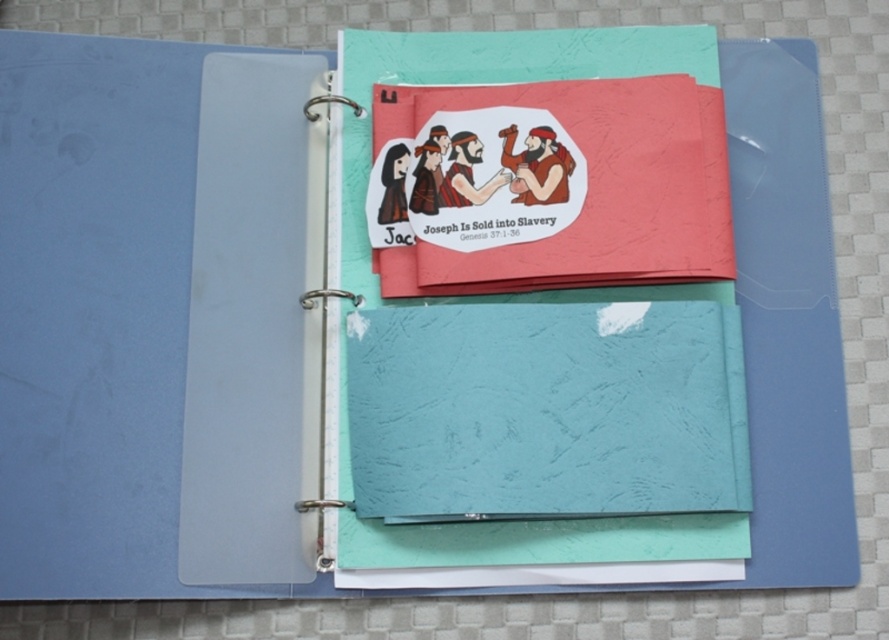
You are a photographer standing 1.2 meters away from the open binder. You want to take a closeup shot of the point at coordinates point (563, 403). Can you reach the point without moving closer than 1.2 meters?

The distance of point (563, 403) from the camera is 1.05 meters, which is closer than your current position of 1.2 meters. Therefore, you cannot reach the point without moving closer than 1.2 meters.

You need to place both the teal textured notepad at center and the matte paper journal at center into a storage box that can only hold items up to the size of the larger one. Which item will not fit if the box is sized exactly for the larger one?

The matte paper journal at center will not fit into the storage box because the teal textured notepad at center is wider, so the box is sized for its larger width, and the matte paper journal at center is narrower.